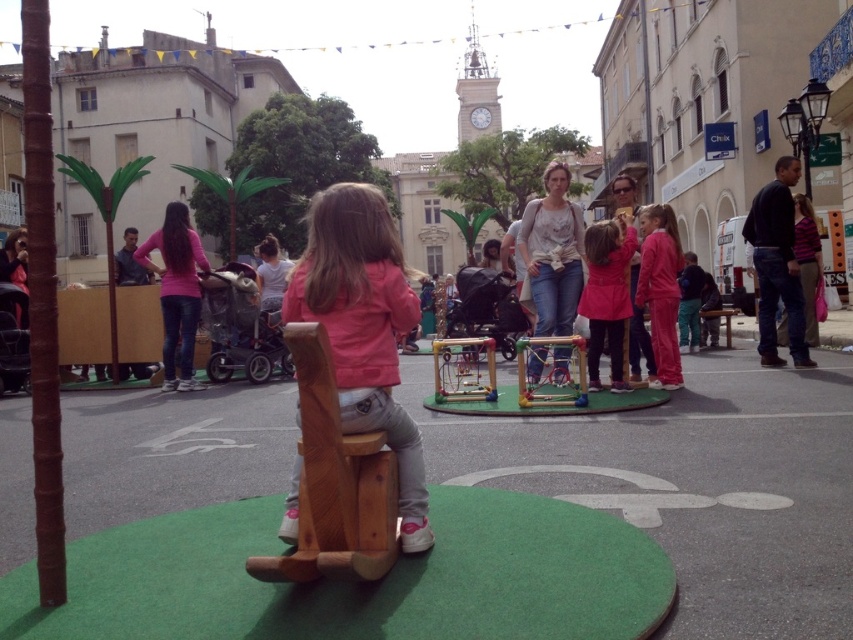
You are a tailor who needs to determine which item takes up more space in your store. You see the matte pink coat at center and the metallic silver frame at center. Which item requires more storage space?

The matte pink coat at center is bigger than the metallic silver frame at center, so it requires more storage space.

You are a photographer setting up a tripod in this scene. You need to place the tripod so that it doesn not block the view of the matte pink coat at center and the metallic silver frame at center. Given that the tripod legs have a spread of 1 meter, can you fit the tripod between them without overlapping either object?

The matte pink coat at center is taller than the metallic silver frame at center. Since the tripod legs spread 1 meter, you can position the tripod between them as long as there is sufficient space horizontally between the two objects. However, the exact placement depends on their horizontal distance apart, which isn not specified here.